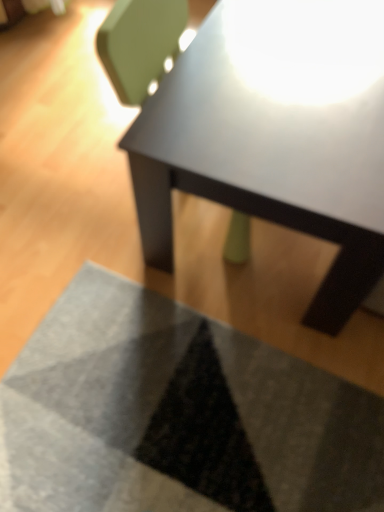
The width and height of the screenshot is (384, 512). What do you see at coordinates (275, 135) in the screenshot?
I see `matte black table at upper center` at bounding box center [275, 135].

Locate an element on the screen. This screenshot has height=512, width=384. matte black table at upper center is located at coordinates (275, 135).

Identify the location of matte black table at upper center. (275, 135).